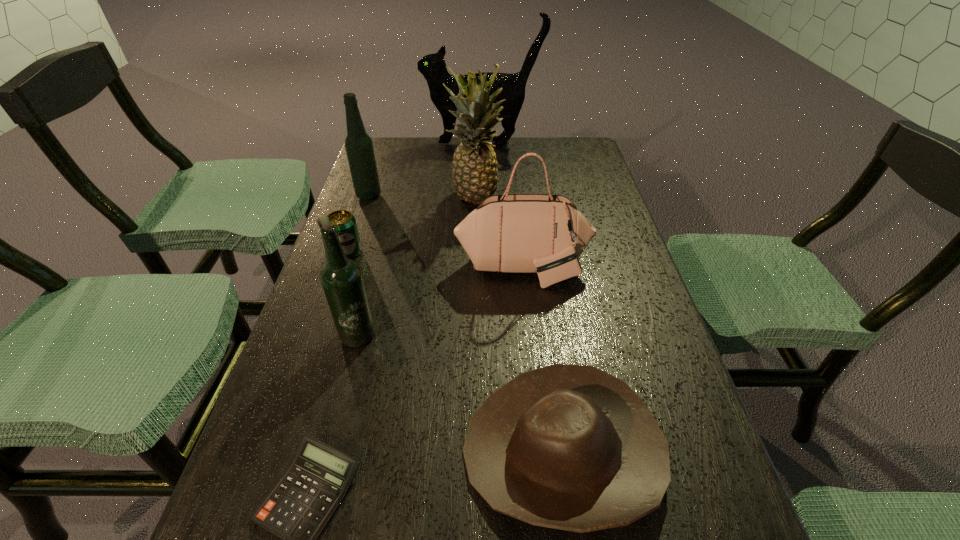
Where is `free spot located 0.340m on the back of the alcohol`? The height and width of the screenshot is (540, 960). free spot located 0.340m on the back of the alcohol is located at coordinates (388, 138).

Locate an element on the screen. free space located on the side of the handbag with the attached pouch is located at coordinates (536, 397).

This screenshot has height=540, width=960. What are the coordinates of `free region located on the front of the beer bottle` in the screenshot? It's located at (317, 494).

You are a GUI agent. You are given a task and a screenshot of the screen. Output one action in this format:
    pyautogui.click(x=<x>, y=<y>)
    Task: Click on the vacant space located 0.070m on the back of the beer can
    
    Given the screenshot: What is the action you would take?
    pyautogui.click(x=356, y=227)

Identify the location of object at the far edge. (433, 67).

This screenshot has height=540, width=960. Find the location of `alcohol located in the left edge section of the desktop`. alcohol located in the left edge section of the desktop is located at coordinates (359, 148).

This screenshot has width=960, height=540. Find the location of `beer bottle that is at the left edge`. beer bottle that is at the left edge is located at coordinates (341, 278).

The image size is (960, 540). Find the location of `beer can present at the left edge`. beer can present at the left edge is located at coordinates (345, 223).

Locate an element on the screen. This screenshot has height=540, width=960. object that is positioned at the right edge is located at coordinates (545, 234).

This screenshot has width=960, height=540. In the image, there is a desktop. Identify the location of free space at the far edge. (526, 140).